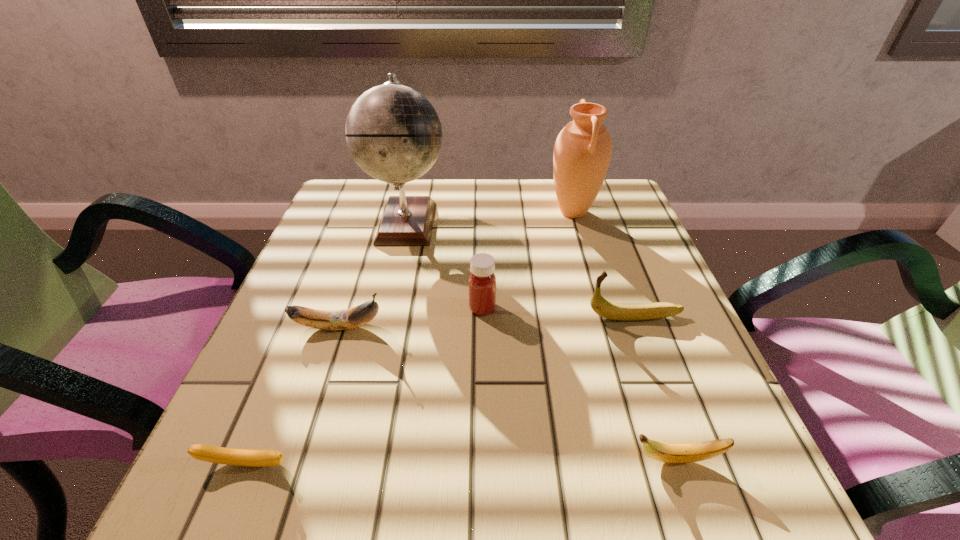
The height and width of the screenshot is (540, 960). In the image, there is a desktop. Find the location of `vacant space at the left edge`. vacant space at the left edge is located at coordinates (370, 246).

Locate an element on the screen. free location at the right edge is located at coordinates (666, 397).

Locate an element on the screen. The width and height of the screenshot is (960, 540). vacant position at the far left corner of the desktop is located at coordinates (341, 187).

Locate an element on the screen. The height and width of the screenshot is (540, 960). vacant point at the near left corner is located at coordinates (217, 471).

In the image, there is a desktop. Where is `blank space at the far right corner`? This screenshot has width=960, height=540. blank space at the far right corner is located at coordinates (579, 229).

Image resolution: width=960 pixels, height=540 pixels. What are the coordinates of `vacant space at the near right corner of the desktop` in the screenshot? It's located at (651, 484).

Locate an element on the screen. Image resolution: width=960 pixels, height=540 pixels. free area in between the second tallest object and the medicine is located at coordinates (528, 260).

Where is `vacant space that's between the shortest banana and the globe`? The image size is (960, 540). vacant space that's between the shortest banana and the globe is located at coordinates (326, 343).

I want to click on vacant point located between the third tallest banana and the globe, so click(x=541, y=341).

Find the location of a particular element. The height and width of the screenshot is (540, 960). free space between the fourth object from left to right and the shortest banana is located at coordinates (365, 387).